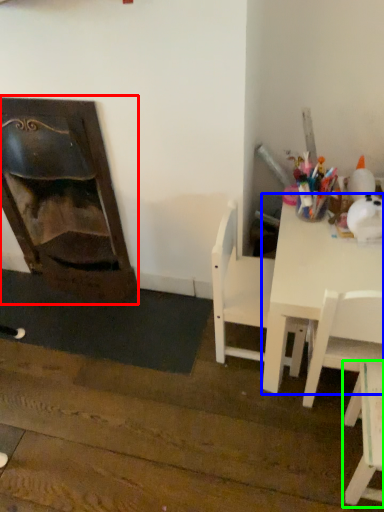
Question: Which object is the farthest from fireplace (highlighted by a red box)? Choose among these: table (highlighted by a blue box) or chair (highlighted by a green box).

Choices:
 (A) table
 (B) chair

Answer: (B)